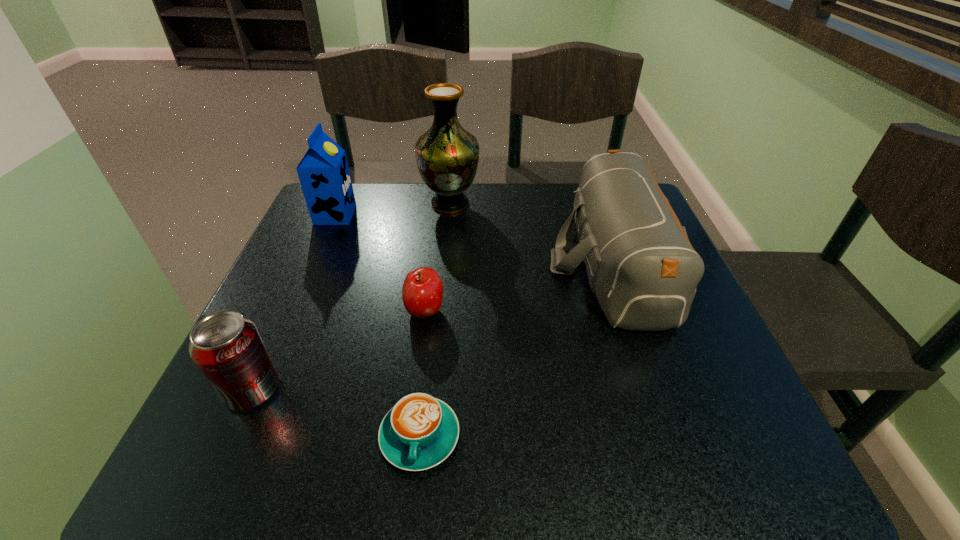
The image size is (960, 540). I want to click on the tallest object, so click(x=447, y=155).

Locate an element on the screen. the fifth shortest object is located at coordinates (323, 172).

This screenshot has height=540, width=960. In order to click on the third tallest object in this screenshot , I will do (x=640, y=263).

I want to click on the rightmost object, so click(x=640, y=263).

You are a GUI agent. You are given a task and a screenshot of the screen. Output one action in this format:
    pyautogui.click(x=<x>, y=<y>)
    Task: Click on the fourth tallest object
    
    Given the screenshot: What is the action you would take?
    pyautogui.click(x=227, y=348)

Where is `the second shortest object`? The width and height of the screenshot is (960, 540). the second shortest object is located at coordinates (422, 293).

This screenshot has width=960, height=540. Identify the location of cappuccino. (420, 431).

Locate an element on the screen. vacant space located on the right of the vase is located at coordinates (516, 204).

Where is `vacant space located with the cap open on the carton`? vacant space located with the cap open on the carton is located at coordinates (419, 214).

Locate an element on the screen. Image resolution: width=960 pixels, height=540 pixels. free space located 0.220m on the left of the duffel bag is located at coordinates (451, 263).